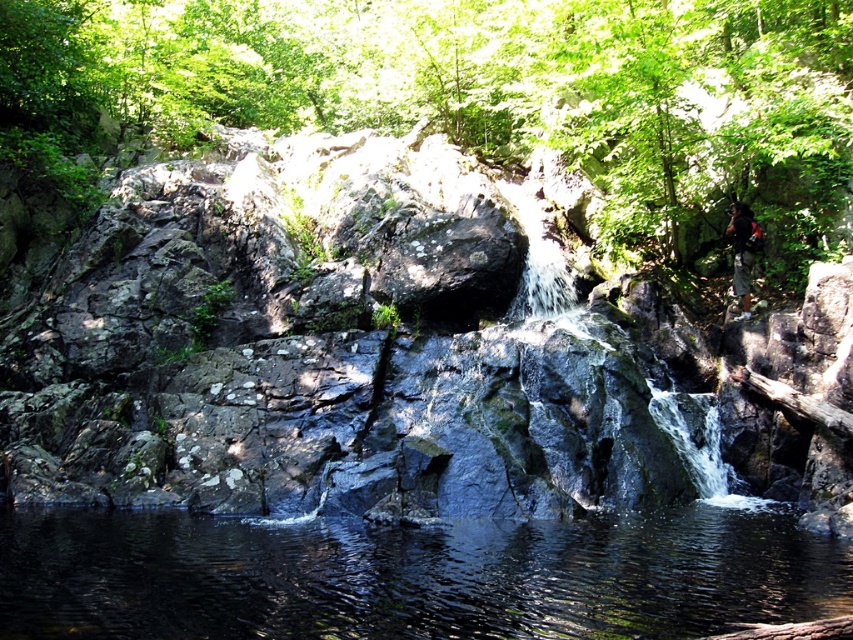
You are standing at the edge of the pool and need to place your dark brown leather backpack at right near the clear water at center. Considering their positions, which object is closer to you?

The clear water at center is closer to the viewer than the dark brown leather backpack at right, so the clear water at center is closer to you.